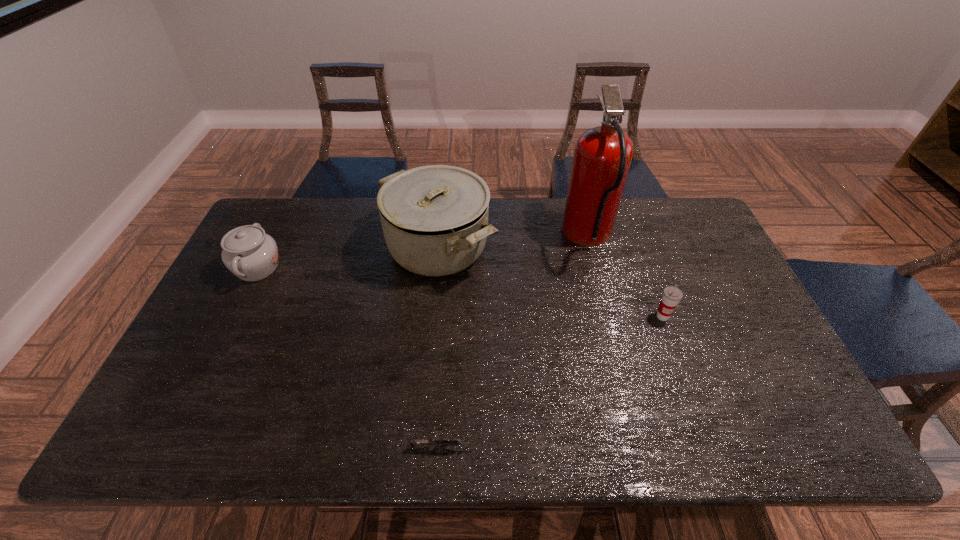
Identify the location of vacant area that lies between the second object from right to left and the fourth shortest object. The image size is (960, 540). (514, 242).

Locate an element on the screen. vacant region between the second nearest object and the leftmost object is located at coordinates (460, 292).

In order to click on unoccupied position between the second object from right to left and the saucepan in this screenshot , I will do `click(514, 242)`.

The width and height of the screenshot is (960, 540). What are the coordinates of `vacant area between the tallest object and the gun` in the screenshot? It's located at (516, 342).

Select which object appears as the closest to the cup. Please provide its 2D coordinates. Your answer should be formatted as a tuple, i.e. [(x, y)], where the tuple contains the x and y coordinates of a point satisfying the conditions above.

[(602, 157)]

At what (x,y) coordinates should I click in order to perform the action: click on object that is the closest one to the saucepan. Please return your answer as a coordinate pair (x, y). The width and height of the screenshot is (960, 540). Looking at the image, I should click on (602, 157).

What are the coordinates of `vacant space that satisfies the following two spatial constraints: 1. on the side of the cup with the logo; 2. aimed along the barrel of the gun` in the screenshot? It's located at (711, 448).